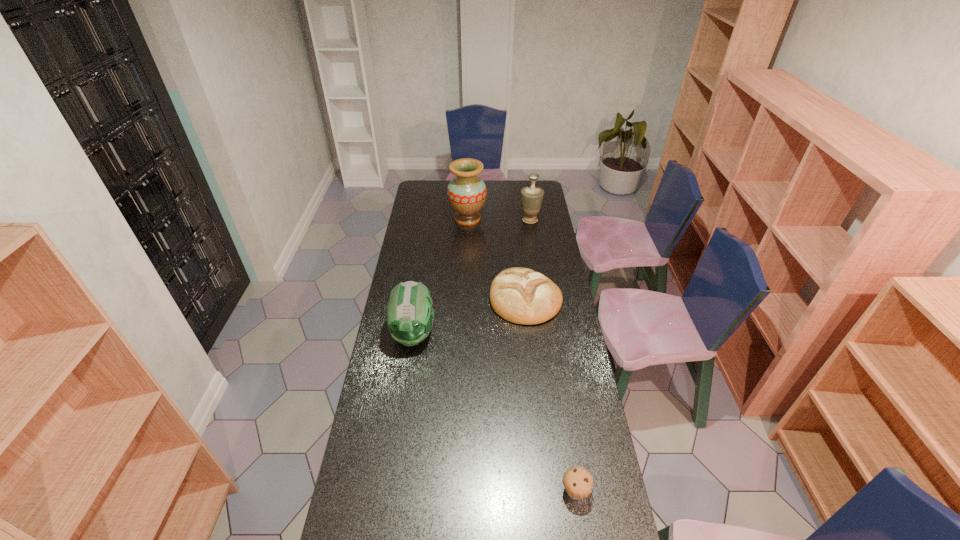
I want to click on free spot at the far right corner of the desktop, so click(x=520, y=184).

At what (x,y) coordinates should I click in order to perform the action: click on empty space that is in between the football helmet and the shortest object. Please return your answer as a coordinate pair (x, y). The image size is (960, 540). Looking at the image, I should click on (494, 413).

Find the location of a particular element. This screenshot has height=540, width=960. vacant region between the muffin and the bread is located at coordinates (550, 395).

At what (x,y) coordinates should I click in order to perform the action: click on empty location between the bread and the nearest object. Please return your answer as a coordinate pair (x, y). Image resolution: width=960 pixels, height=540 pixels. Looking at the image, I should click on (550, 395).

Locate an element on the screen. This screenshot has width=960, height=540. empty space that is in between the leftmost object and the nearest object is located at coordinates (494, 413).

You are a GUI agent. You are given a task and a screenshot of the screen. Output one action in this format:
    pyautogui.click(x=<x>, y=<y>)
    Task: Click on the vacant area that lies between the third tallest object and the urn
    The image size is (960, 540).
    Given the screenshot: What is the action you would take?
    pyautogui.click(x=471, y=277)

What are the coordinates of `empty location between the tallest object and the leftmost object` in the screenshot? It's located at (441, 276).

You are a GUI agent. You are given a task and a screenshot of the screen. Output one action in this format:
    pyautogui.click(x=<x>, y=<y>)
    Task: Click on the free space between the third tallest object and the bread
    
    Given the screenshot: What is the action you would take?
    pyautogui.click(x=469, y=316)

At what (x,y) coordinates should I click in order to perform the action: click on vacant area that lies between the third shortest object and the bread. Please return your answer as a coordinate pair (x, y). This screenshot has width=960, height=540. Looking at the image, I should click on (469, 316).

You are a GUI agent. You are given a task and a screenshot of the screen. Output one action in this format:
    pyautogui.click(x=<x>, y=<y>)
    Task: Click on the vacant area that lies between the nearest object and the fourth object from right to left
    This screenshot has height=540, width=960.
    Given the screenshot: What is the action you would take?
    pyautogui.click(x=521, y=355)